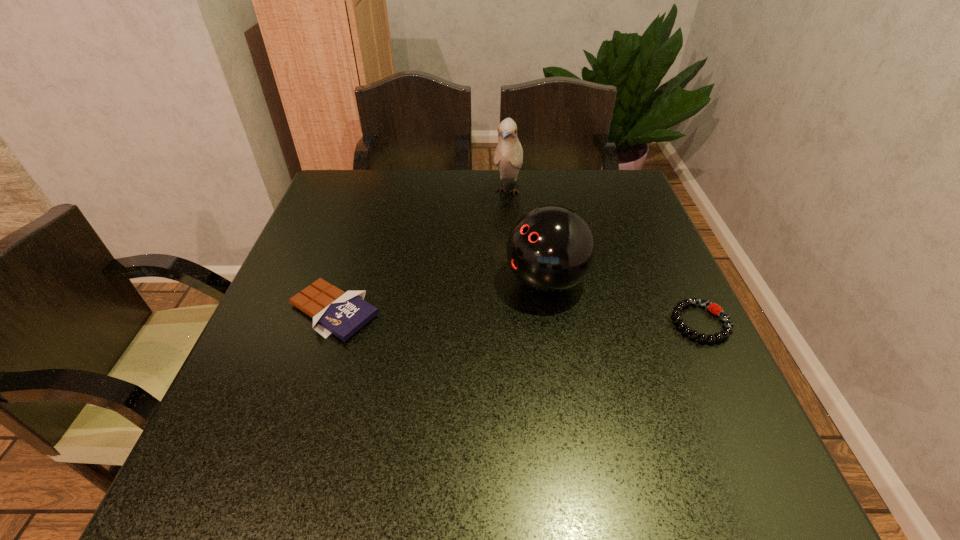
The image size is (960, 540). I want to click on vacant space at the right edge of the desktop, so click(661, 280).

Locate an element on the screen. This screenshot has height=540, width=960. blank space at the far left corner of the desktop is located at coordinates click(x=354, y=206).

Locate an element on the screen. The width and height of the screenshot is (960, 540). free location at the far right corner of the desktop is located at coordinates (589, 178).

This screenshot has width=960, height=540. I want to click on vacant space at the near right corner of the desktop, so click(x=723, y=419).

Where is `vacant area between the rightmost object and the second shortest object`? vacant area between the rightmost object and the second shortest object is located at coordinates (517, 317).

Find the location of `free space between the rightmost object and the leftmost object`. free space between the rightmost object and the leftmost object is located at coordinates (517, 317).

You are a GUI agent. You are given a task and a screenshot of the screen. Output one action in this format:
    pyautogui.click(x=<x>, y=<y>)
    Task: Click on the vacant region between the farthest object and the chocolate bar
    The height and width of the screenshot is (540, 960).
    Given the screenshot: What is the action you would take?
    pyautogui.click(x=420, y=251)

Locate an element on the screen. This screenshot has height=540, width=960. free space between the second tallest object and the rightmost object is located at coordinates (623, 302).

Where is `empty space that is in between the shortest object and the bird`? This screenshot has height=540, width=960. empty space that is in between the shortest object and the bird is located at coordinates (604, 256).

Find the location of a particular element. This screenshot has width=960, height=540. vacant area that lies between the bird and the rightmost object is located at coordinates tap(604, 256).